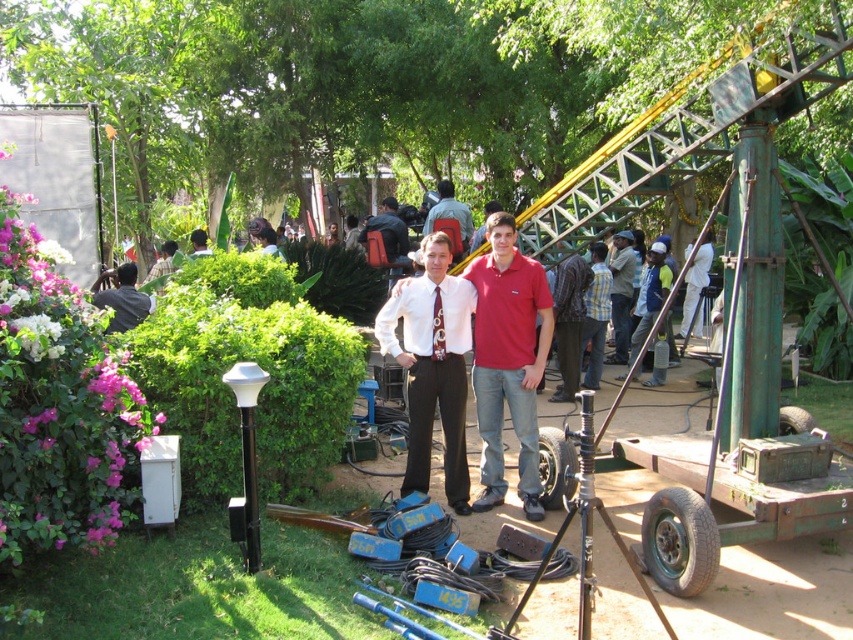
You are a photographer adjusting the camera settings to ensure both the white glossy shirt at center and the dark blue jeans at center are in focus. Which clothing item should you adjust the focus to prioritize based on their positions?

The white glossy shirt at center has a lesser height compared to dark blue jeans at center, so you should prioritize focusing on the white glossy shirt at center first since it is closer to the camera.

You are standing at the center of the production site and want to reach both the point at coordinates point (456,413) and point (672,348). Which point should you head to first if you want to reach the one closer to you first?

You should head to point (456,413) first because it is closer to you than point (672,348).

You are a photographer adjusting your camera settings. You notice the white glossy shirt at center and want to ensure it is properly lit. Given the lamp post nearby, can you determine if the shirt is within the lamp post light range?

The white glossy shirt at center is located at point (432, 364). Since the lamp post is nearby, it is likely within the light range, but without specific light range details, we cannot confirm. However, the shirt is positioned close enough to potentially be illuminated by the lamp post.